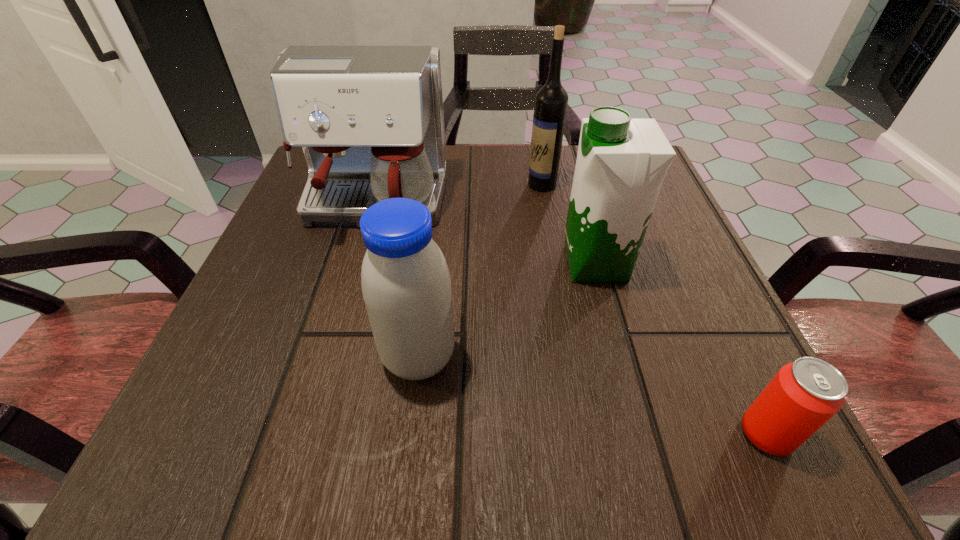
The height and width of the screenshot is (540, 960). Find the location of `soya milk that is at the right edge`. soya milk that is at the right edge is located at coordinates (621, 163).

The image size is (960, 540). I want to click on beer can that is at the right edge, so click(805, 394).

This screenshot has width=960, height=540. In order to click on object that is at the far left corner in this screenshot , I will do `click(370, 121)`.

In order to click on object present at the near right corner in this screenshot , I will do `click(805, 394)`.

Image resolution: width=960 pixels, height=540 pixels. I want to click on vacant region at the far edge of the desktop, so click(494, 172).

Image resolution: width=960 pixels, height=540 pixels. In order to click on free space at the near edge of the desktop in this screenshot , I will do `click(396, 445)`.

Where is `free location at the left edge`? free location at the left edge is located at coordinates 255,329.

This screenshot has width=960, height=540. Identify the location of free location at the right edge of the desktop. (698, 287).

Identify the location of vacant space at the far right corner of the desktop. (577, 153).

Find the location of a particular element. The width and height of the screenshot is (960, 540). free space between the rightmost object and the wine bottle is located at coordinates (654, 309).